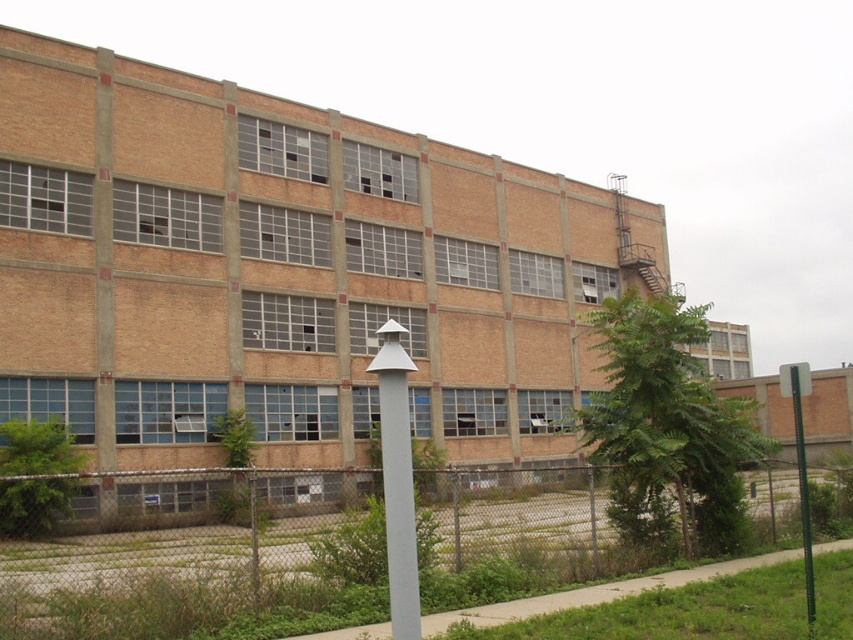
You are a construction worker assessing the abandoned industrial site. You need to determine if the green metallic pole at right can be safely placed horizontally against the brown brick building at center without exceeding its height. Can you confirm this?

The brown brick building at center has a greater height compared to the green metallic pole at right. Therefore, placing the green metallic pole at right horizontally against the brown brick building at center would be safe as the pole is shorter in height than the building.

You are a city planner evaluating the space in front of the brown brick building at center and the green metallic pole at right. Which object occupies a smaller horizontal space from left to right?

The brown brick building at center has a smaller width than the green metallic pole at right, so it occupies less horizontal space.